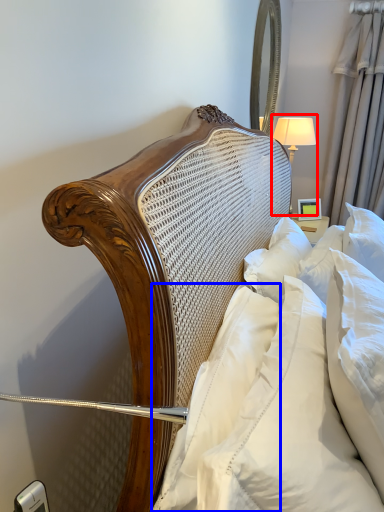
Question: Which object is further to the camera taking this photo, bedside lamp (highlighted by a red box) or pillow (highlighted by a blue box)?

Choices:
 (A) bedside lamp
 (B) pillow

Answer: (A)